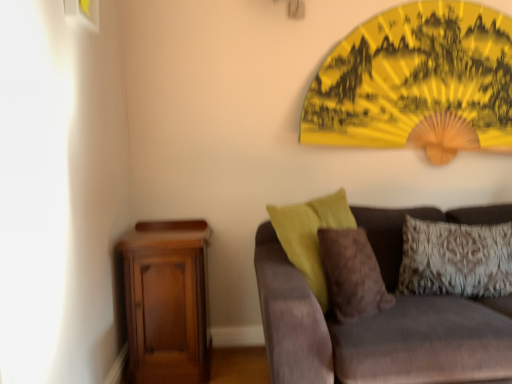
Question: Visually, is velvet brown couch at lower right positioned to the left or to the right of patterned fabric pillow at right, marked as the 1th pillow in a right-to-left arrangement?

Choices:
 (A) left
 (B) right

Answer: (A)

Question: From the image's perspective, is velvet brown couch at lower right above or below patterned fabric pillow at right, positioned as the 2th pillow in left-to-right order?

Choices:
 (A) above
 (B) below

Answer: (B)

Question: Estimate the real-world distances between objects in this image. Which object is farther from the mahogany wood nightstand at lower left?

Choices:
 (A) patterned fabric pillow at right, positioned as the 2th pillow in left-to-right order
 (B) matte white picture frame at upper left
 (C) brown fuzzy pillow at center, which appears as the 1th pillow when viewed from the left
 (D) velvet brown couch at lower right

Answer: (B)

Question: Which of these objects is positioned farthest from the brown fuzzy pillow at center, the 2th pillow viewed from the right?

Choices:
 (A) mahogany wood nightstand at lower left
 (B) matte white picture frame at upper left
 (C) patterned fabric pillow at right, positioned as the 2th pillow in left-to-right order
 (D) velvet brown couch at lower right

Answer: (B)